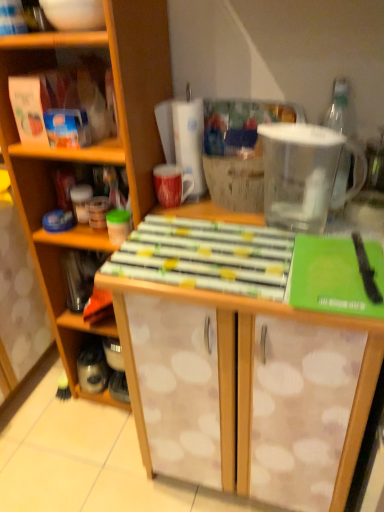
The width and height of the screenshot is (384, 512). Describe the element at coordinates (304, 174) in the screenshot. I see `transparent plastic pitcher at upper right` at that location.

Describe the element at coordinates (89, 150) in the screenshot. I see `white dotted wood cabinet at center` at that location.

The height and width of the screenshot is (512, 384). What do you see at coordinates (249, 374) in the screenshot?
I see `wooden table at center` at bounding box center [249, 374].

In order to click on metallic silver container at left in this screenshot , I will do `click(86, 325)`.

Could you tell me if white dotted wood cabinet at center is facing metallic silver container at left?

Yes.

From a real-world perspective, which object stands above the other?

From a 3D spatial view, white dotted wood cabinet at center is above.

Considering the sizes of objects white dotted wood cabinet at center and metallic silver container at left in the image provided, who is smaller, white dotted wood cabinet at center or metallic silver container at left?

With smaller size is metallic silver container at left.

From a real-world perspective, between wooden table at center and transparent plastic pitcher at upper right, who is vertically higher?

From a 3D spatial view, transparent plastic pitcher at upper right is above.

Based on the photo, does wooden table at center have a lesser height compared to transparent plastic pitcher at upper right?

Incorrect, the height of wooden table at center does not fall short of that of transparent plastic pitcher at upper right.

Which of these two, wooden table at center or transparent plastic pitcher at upper right, is smaller?

transparent plastic pitcher at upper right is smaller.

Is wooden table at center inside the boundaries of transparent plastic pitcher at upper right, or outside?

wooden table at center is outside transparent plastic pitcher at upper right.

Which of these two, white dotted wood cabinet at center or wooden table at center, is bigger?

With larger size is wooden table at center.

Locate an element on the screen. The image size is (384, 512). cabinetry that appears above the wooden table at center (from the image's perspective) is located at coordinates (89, 150).

From a real-world perspective, is white dotted wood cabinet at center over wooden table at center?

Yes, from a real-world perspective, white dotted wood cabinet at center is on top of wooden table at center.

I want to click on table below the metallic silver container at left (from the image's perspective), so click(249, 374).

From the image's perspective, which one is positioned higher, metallic silver container at left or wooden table at center?

From the image's view, metallic silver container at left is above.

Is metallic silver container at left wider or thinner than wooden table at center?

In the image, metallic silver container at left appears to be more narrow than wooden table at center.

Consider the image. Would you consider metallic silver container at left to be distant from wooden table at center?

No, metallic silver container at left is not far away from wooden table at center.

Between wooden table at center and metallic silver container at left, which one is positioned in front?

wooden table at center is in front.

In the scene shown: Can you see wooden table at center touching metallic silver container at left?

No.

Based on the photo, considering the sizes of wooden table at center and metallic silver container at left in the image, is wooden table at center bigger or smaller than metallic silver container at left?

In the image, wooden table at center appears to be larger than metallic silver container at left.

Where is `shelf above the wooden table at center (from the image's perspective)`? shelf above the wooden table at center (from the image's perspective) is located at coordinates (86, 325).

Is transparent plastic pitcher at upper right further to camera compared to white dotted wood cabinet at center?

Yes, transparent plastic pitcher at upper right is further from the camera.

Is there a large distance between transparent plastic pitcher at upper right and white dotted wood cabinet at center?

No, transparent plastic pitcher at upper right is not far from white dotted wood cabinet at center.

Considering the positions of points (323, 177) and (120, 34), is point (323, 177) closer to camera compared to point (120, 34)?

No, (323, 177) is behind (120, 34).

Does point (147, 7) lie in front of point (346, 148)?

Yes.

From a real-world perspective, who is located higher, white dotted wood cabinet at center or transparent plastic pitcher at upper right?

transparent plastic pitcher at upper right.

Based on their sizes in the image, would you say white dotted wood cabinet at center is bigger or smaller than transparent plastic pitcher at upper right?

In the image, white dotted wood cabinet at center appears to be larger than transparent plastic pitcher at upper right.

Find the location of `cabinetry above the metallic silver container at left (from the image's perspective)`. cabinetry above the metallic silver container at left (from the image's perspective) is located at coordinates (89, 150).

In order to click on appliance located above the wooden table at center (from a real-world perspective) in this screenshot , I will do `click(304, 174)`.

From the picture: Looking at the image, which one is located closer to wooden table at center, transparent plastic pitcher at upper right or metallic silver container at left?

transparent plastic pitcher at upper right is closer to wooden table at center.

Estimate the real-world distances between objects in this image. Which object is further from metallic silver container at left, transparent plastic pitcher at upper right or white dotted wood cabinet at center?

transparent plastic pitcher at upper right is positioned further to the anchor metallic silver container at left.

Based on the photo, considering their positions, is metallic silver container at left positioned further to wooden table at center than white dotted wood cabinet at center?

metallic silver container at left is further to wooden table at center.

Based on their spatial positions, is white dotted wood cabinet at center or transparent plastic pitcher at upper right further from wooden table at center?

Based on the image, white dotted wood cabinet at center appears to be further to wooden table at center.

Based on their spatial positions, is white dotted wood cabinet at center or metallic silver container at left closer to wooden table at center?

white dotted wood cabinet at center is positioned closer to the anchor wooden table at center.

From the image, which object appears to be nearer to transparent plastic pitcher at upper right, metallic silver container at left or white dotted wood cabinet at center?

Based on the image, white dotted wood cabinet at center appears to be nearer to transparent plastic pitcher at upper right.

Estimate the real-world distances between objects in this image. Which object is closer to white dotted wood cabinet at center, metallic silver container at left or wooden table at center?

metallic silver container at left is positioned closer to the anchor white dotted wood cabinet at center.

Looking at the image, which one is located closer to transparent plastic pitcher at upper right, wooden table at center or metallic silver container at left?

wooden table at center lies closer to transparent plastic pitcher at upper right than the other object.

Find the location of a particular element. The width and height of the screenshot is (384, 512). table situated between white dotted wood cabinet at center and transparent plastic pitcher at upper right from left to right is located at coordinates coord(249,374).

At what (x,y) coordinates should I click in order to perform the action: click on cabinetry positioned between wooden table at center and metallic silver container at left from near to far. Please return your answer as a coordinate pair (x, y). This screenshot has width=384, height=512. Looking at the image, I should click on (89, 150).

At what (x,y) coordinates should I click in order to perform the action: click on cabinetry between metallic silver container at left and transparent plastic pitcher at upper right in the horizontal direction. Please return your answer as a coordinate pair (x, y). Looking at the image, I should click on (89, 150).

Find the location of a particular element. table located between metallic silver container at left and transparent plastic pitcher at upper right in the left-right direction is located at coordinates (249, 374).